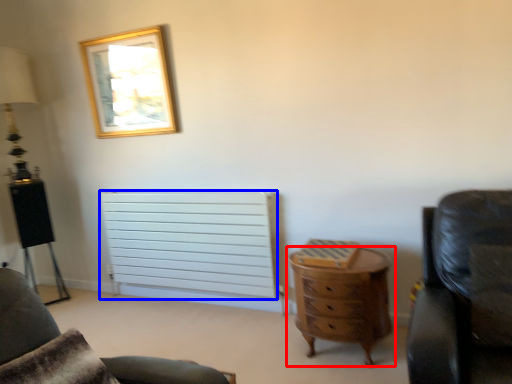
Question: Among these objects, which one is nearest to the camera, chest of drawers (highlighted by a red box) or radiator (highlighted by a blue box)?

Choices:
 (A) chest of drawers
 (B) radiator

Answer: (A)